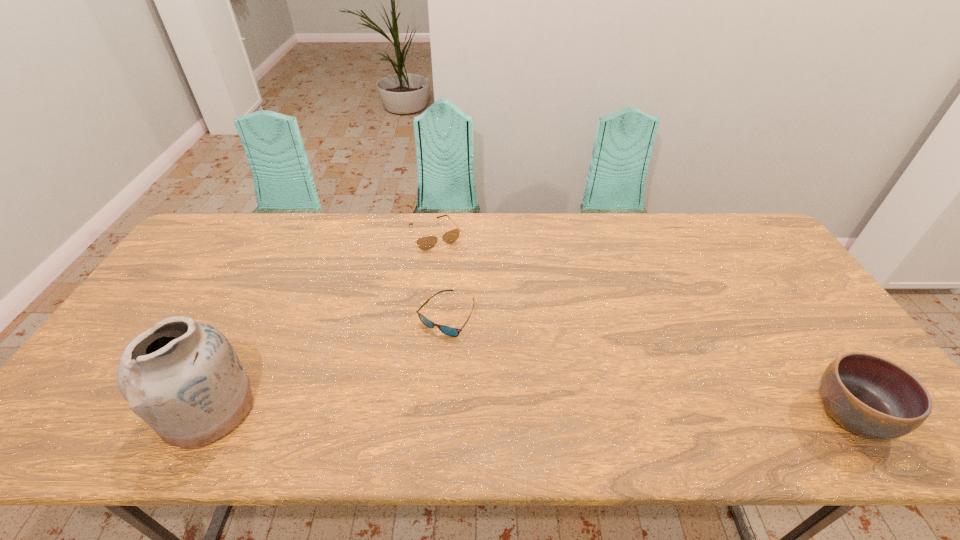
This screenshot has width=960, height=540. I want to click on vacant space on the desktop that is between the leftmost object and the bowl and is positioned on the front-facing side of the taller sunglasses, so click(x=539, y=411).

Where is `free space on the desktop that is between the tallest object and the rightmost object and is positioned at the front of the shortest object showing the lenses`? This screenshot has width=960, height=540. free space on the desktop that is between the tallest object and the rightmost object and is positioned at the front of the shortest object showing the lenses is located at coordinates (455, 410).